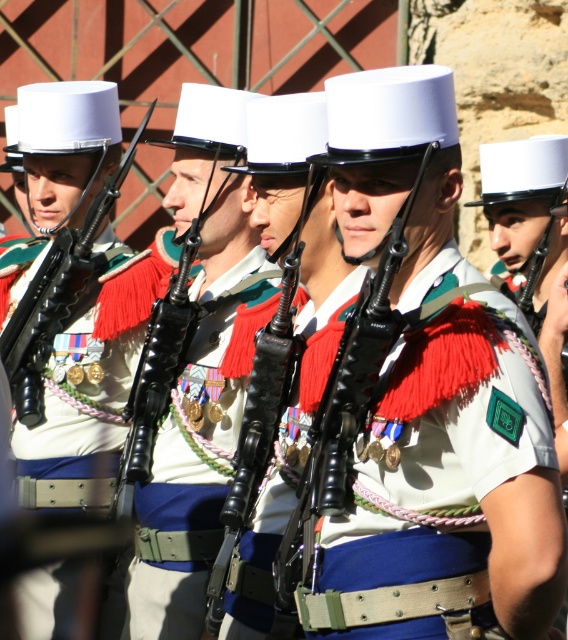
Image resolution: width=568 pixels, height=640 pixels. I want to click on white matte uniform at center, so click(456, 413).

This screenshot has height=640, width=568. What do you see at coordinates (456, 413) in the screenshot? I see `white matte uniform at center` at bounding box center [456, 413].

Is point (412, 348) farther from viewer compared to point (160, 461)?

No, (412, 348) is closer to viewer.

Where is `white matte uniform at center`? The image size is (568, 640). white matte uniform at center is located at coordinates (456, 413).

Which is more to the right, matte white uniform at center or shiny black rifle at center?

shiny black rifle at center

From the picture: Does matte white uniform at center come behind shiny black rifle at center?

Yes, it is.

Is point (98, 500) closer to viewer compared to point (183, 596)?

That is False.

The height and width of the screenshot is (640, 568). What are the coordinates of `matte white uniform at center` in the screenshot? It's located at (60, 163).

Between white matte uniform at center and matte white uniform at center, which one has less height?

Standing shorter between the two is white matte uniform at center.

Image resolution: width=568 pixels, height=640 pixels. Find the location of `white matte uniform at center`. white matte uniform at center is located at coordinates (456, 413).

Is point (373, 490) positioned before point (78, 337)?

Yes, it is.

Find the location of `white matte uniform at center`. white matte uniform at center is located at coordinates [x=456, y=413].